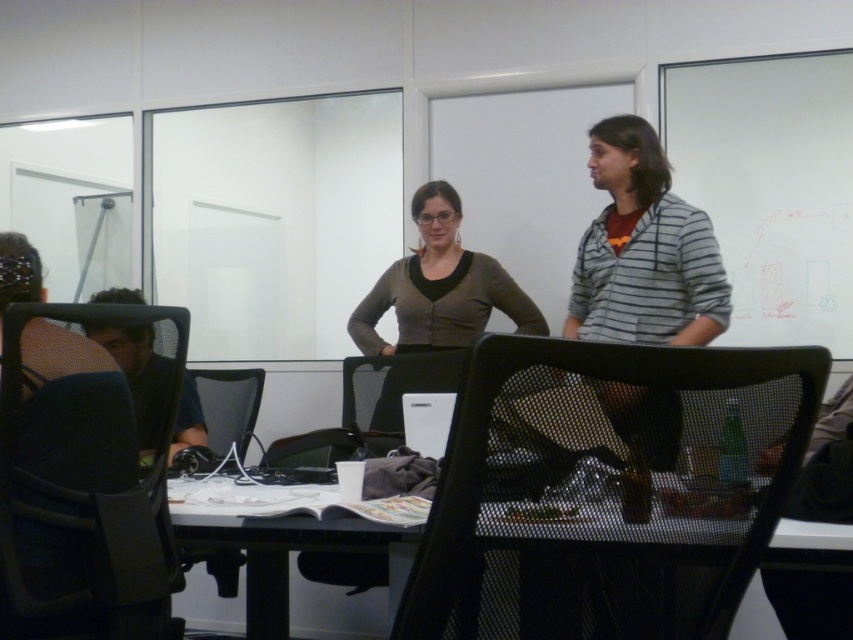
You are standing at the camera position and want to reach the point marked as point (494, 273). Is the distance more than 3 meters?

Yes, the distance between the camera and point (494, 273) is 3.20 meters, which is more than 3 meters.

You are a delivery person who needs to place a large package on the table. The package is taller than the matte brown cardigan at center. Will the package fit on the black mesh table at center without exceeding its height?

The matte brown cardigan at center is much taller than the black mesh table at center. Since the package is taller than the matte brown cardigan at center, it will definitely exceed the table height and won

From the picture: You are organizing a photoshoot and need to place a large prop between the matte brown cardigan at center and the dark blue shirt at left. Based on their sizes, which object should the prop be closer to?

The matte brown cardigan at center is larger in size compared to the dark blue shirt at left, so the large prop should be placed closer to the matte brown cardigan at center to maintain visual balance.